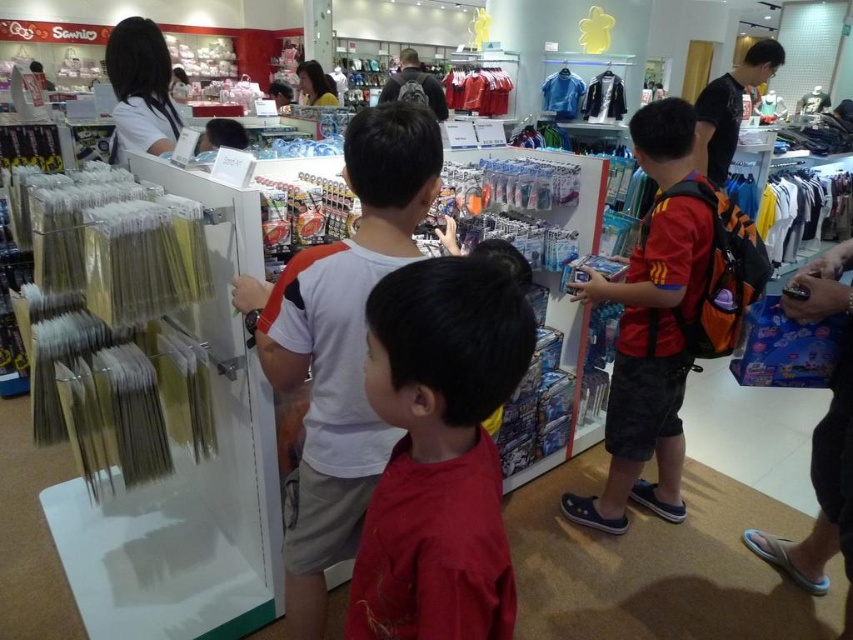
Question: From the image, what is the correct spatial relationship of white matte shirt at center in relation to matte black backpack at center?

Choices:
 (A) below
 (B) above

Answer: (A)

Question: Does red cotton shirt at center appear on the left side of matte white shirt at upper left?

Choices:
 (A) yes
 (B) no

Answer: (B)

Question: Which object is the farthest from the red polyester shirt at center?

Choices:
 (A) white matte shirt at center
 (B) red cotton shirt at center
 (C) matte white shirt at upper center
 (D) black matte backpack at upper right

Answer: (C)

Question: Which point is farther to the camera?

Choices:
 (A) (450, 573)
 (B) (730, 124)
 (C) (407, 92)
 (D) (323, 86)

Answer: (D)

Question: Is red cotton shirt at center further to the viewer compared to matte black backpack at center?

Choices:
 (A) no
 (B) yes

Answer: (A)

Question: Among these objects, which one is nearest to the camera?

Choices:
 (A) black matte backpack at upper right
 (B) red polyester shirt at center
 (C) matte white shirt at upper center

Answer: (B)